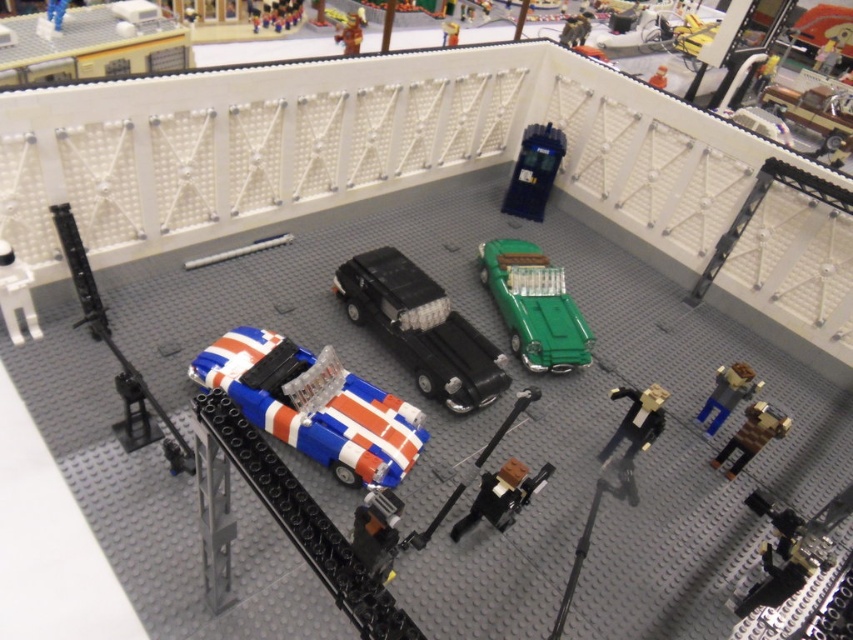
Question: Which object is positioned farthest from the green glossy car at center?

Choices:
 (A) black plastic figure at lower right
 (B) blue and white plastic car at lower right
 (C) smooth brown figurine at upper center

Answer: (C)

Question: Which object appears farthest from the camera in this image?

Choices:
 (A) blue and white plastic car at lower right
 (B) green glossy car at center
 (C) blue and white striped car at lower left

Answer: (B)

Question: Estimate the real-world distances between objects in this image. Which object is closer to the metallic blue police box at upper right?

Choices:
 (A) brown matte figure at center
 (B) brick-patterned toy soldiers at upper center
 (C) brick-patterned plastic train car at lower left

Answer: (C)

Question: Is black plastic car at center below blue and white plastic car at lower right?

Choices:
 (A) no
 (B) yes

Answer: (A)

Question: Does smooth brown figurine at upper center lie behind smooth plastic toy car at center?

Choices:
 (A) yes
 (B) no

Answer: (B)

Question: Can you confirm if black plastic figure at lower right is smaller than brick-patterned toy soldiers at upper center?

Choices:
 (A) no
 (B) yes

Answer: (B)